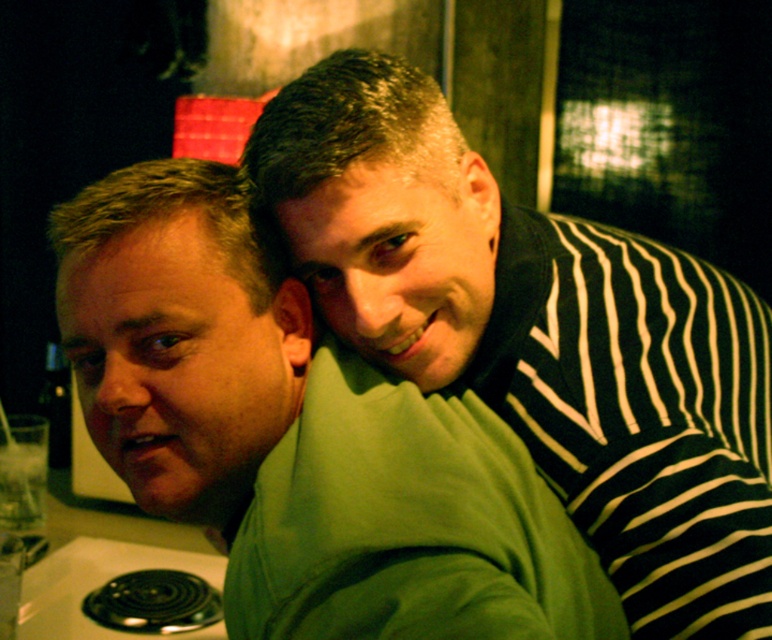
Question: Is green fabric at upper left behind green matte sweatshirt at center?

Choices:
 (A) yes
 (B) no

Answer: (A)

Question: Which object appears closest to the camera in this image?

Choices:
 (A) green matte sweatshirt at center
 (B) green fabric at upper left

Answer: (A)

Question: Which of the following is the farthest from the observer?

Choices:
 (A) (498, 410)
 (B) (100, 179)

Answer: (B)

Question: Can you confirm if green fabric at upper left is bigger than green matte sweatshirt at center?

Choices:
 (A) yes
 (B) no

Answer: (B)

Question: Is green fabric at upper left wider than green matte sweatshirt at center?

Choices:
 (A) no
 (B) yes

Answer: (B)

Question: Among these points, which one is nearest to the camera?

Choices:
 (A) (669, 275)
 (B) (346, 618)

Answer: (B)